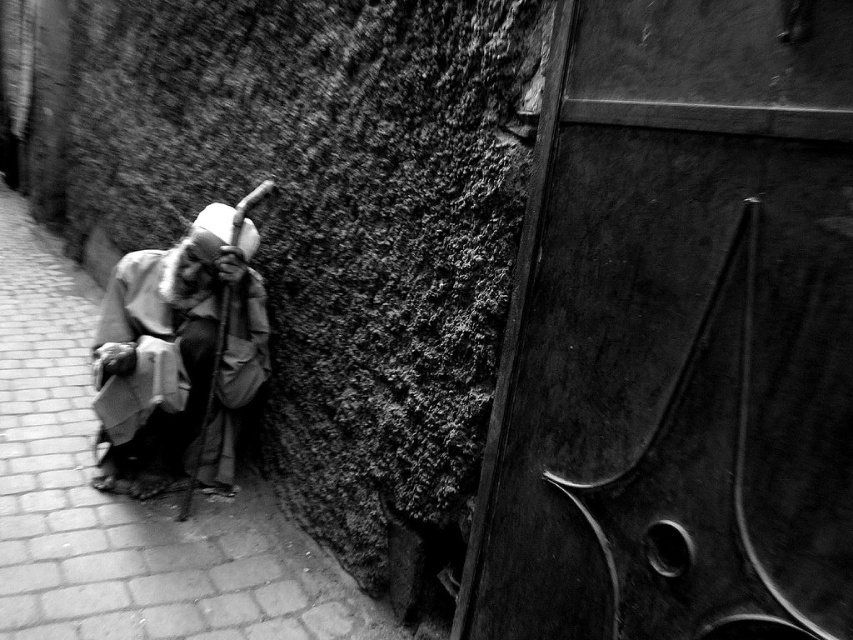
You are a delivery robot with a 60 cm wide package. You need to navigate through the alleyway shown in the image. There is a brick pavement at left and a gray fabric cloth at left. Can you fit your package between them?

The brick pavement at left and gray fabric cloth at left are 54.10 centimeters apart. Since the package is 60 cm wide, it cannot fit between them as the space is narrower than the package.

You are standing in the alleyway and notice two points marked on the ground. The first point is at coordinates point (88, 428) and the second is at point (154, 378). Which point is closer to you as you face the alleyway?

Point (154, 378) is closer to you because it is in front of point (88, 428), which is behind it.

You are a delivery person needing to place a small package on the brick pavement at left or the gray fabric cloth at left. Which surface can accommodate the package without it hanging off the edge?

The brick pavement at left has a larger width than the gray fabric cloth at left, so the package will fit better on the brick pavement at left.